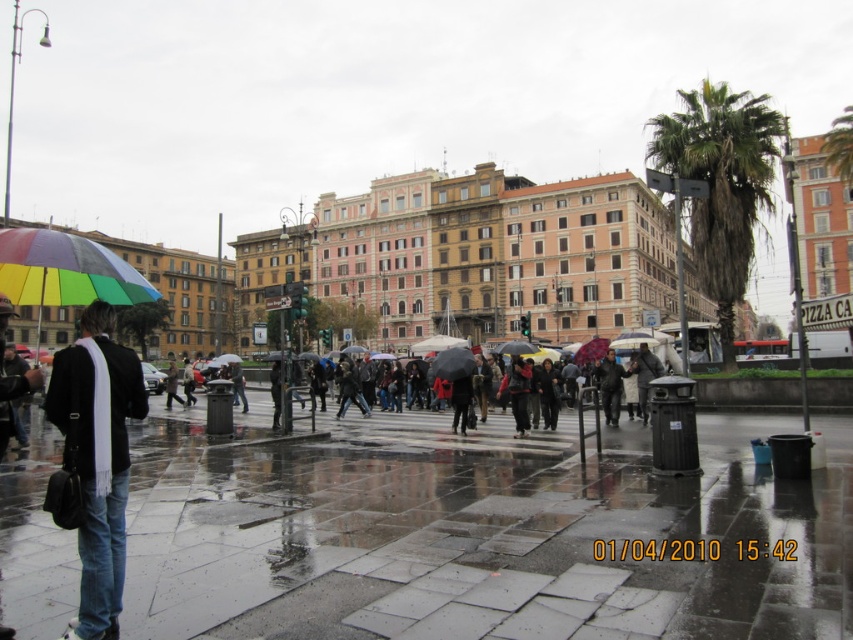
You are standing at the center of the image and want to move towards the rainbow fabric umbrella at center. In which direction should you move?

Since the rainbow fabric umbrella at center is located at point (451, 364), you should move towards the center of the image to reach it.

You are a delivery person trying to navigate through the rain. You see the shiny concrete pavement at center and the rainbow fabric umbrella at center. Which object is positioned to the right of the other?

The shiny concrete pavement at center is to the right of the rainbow fabric umbrella at center.